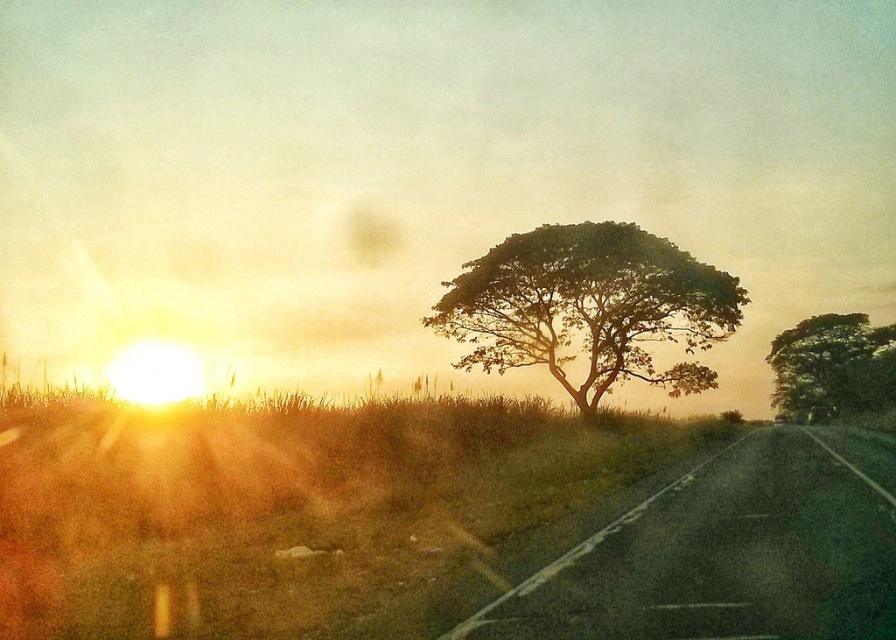
Question: Estimate the real-world distances between objects in this image. Which object is closer to the black asphalt highway at lower right?

Choices:
 (A) green leafy tree at center
 (B) green leafy tree at right

Answer: (A)

Question: Observing the image, what is the correct spatial positioning of black asphalt highway at lower right in reference to green leafy tree at center?

Choices:
 (A) left
 (B) right

Answer: (B)

Question: Estimate the real-world distances between objects in this image. Which object is closer to the green leafy tree at right?

Choices:
 (A) green leafy tree at center
 (B) black asphalt highway at lower right

Answer: (A)

Question: Can you confirm if green leafy tree at center is positioned above green leafy tree at right?

Choices:
 (A) yes
 (B) no

Answer: (A)

Question: Does black asphalt highway at lower right appear on the right side of green leafy tree at right?

Choices:
 (A) no
 (B) yes

Answer: (A)

Question: Which object is the farthest from the green leafy tree at right?

Choices:
 (A) green leafy tree at center
 (B) black asphalt highway at lower right

Answer: (B)